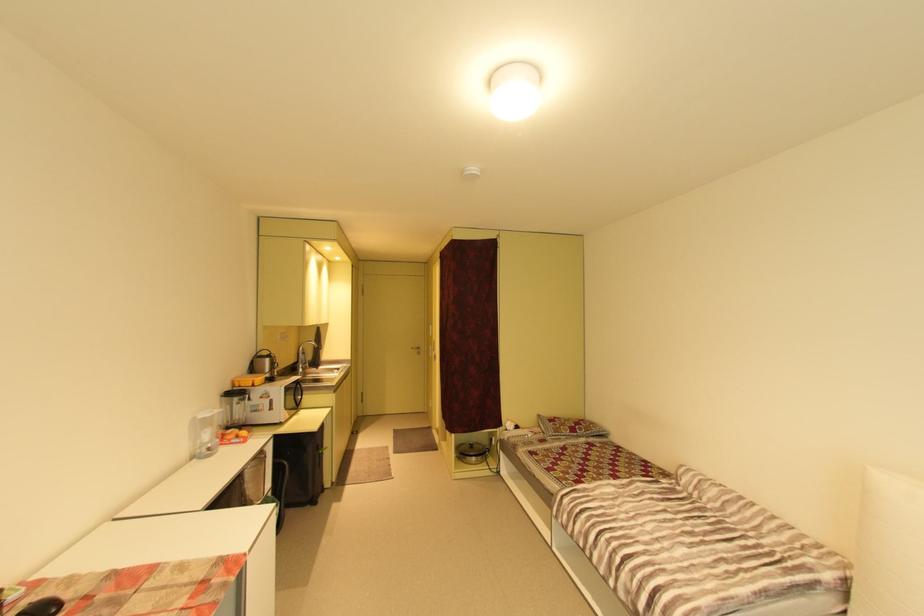
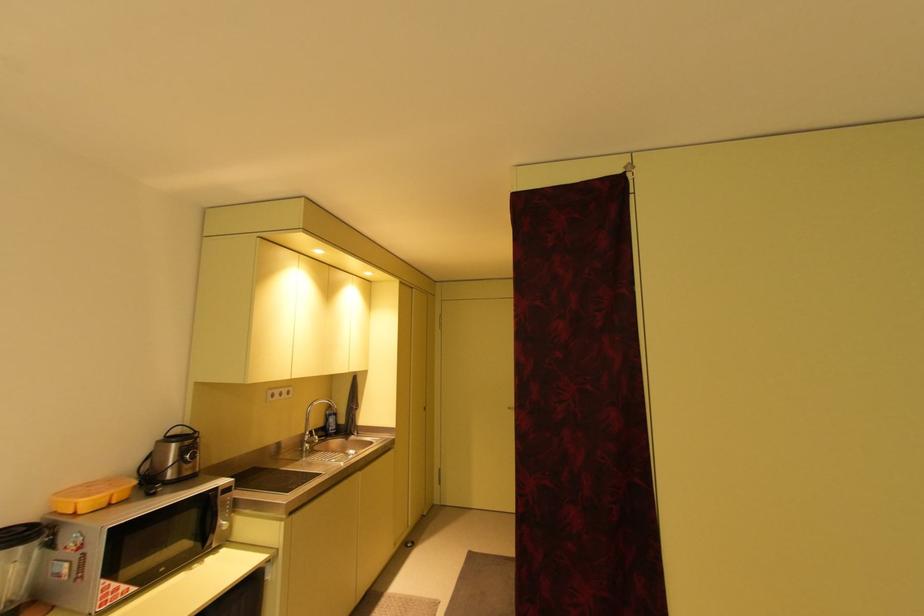
Question: What movement of the cameraman would produce the second image?

Choices:
 (A) Left
 (B) Right
 (C) Forward
 (D) Backward

Answer: (C)